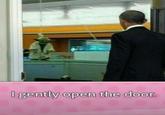
Locate an element on the screen. This screenshot has height=115, width=165. wall is located at coordinates (4, 58).